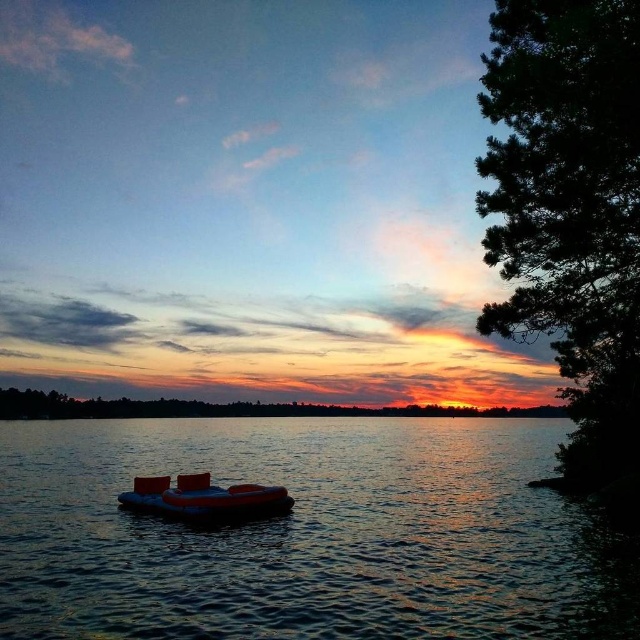
You are standing on the lakeside and want to locate the translucent rubber boat at center. According to the coordinates provided, where exactly is the boat positioned in the image?

The translucent rubber boat at center is positioned at the coordinates point (305, 532) in the image.

You are planning to take a photo of the orange rubber boat at center and the green leafy tree at center from the lakeside. Which object will appear wider in the photo?

The green leafy tree at center will appear wider in the photo since its width is larger than the orange rubber boat at center.

You are standing at the edge of the lake and want to reach the green textured tree at right. The inflatable boat with two red seats is currently floating on the water. Can you use the boat to reach the tree?

The inflatable boat with two red seats is 9.92 meters away from the green textured tree at right. Since the boat is floating on the water, you can use it to reach the tree by rowing or paddling towards it.